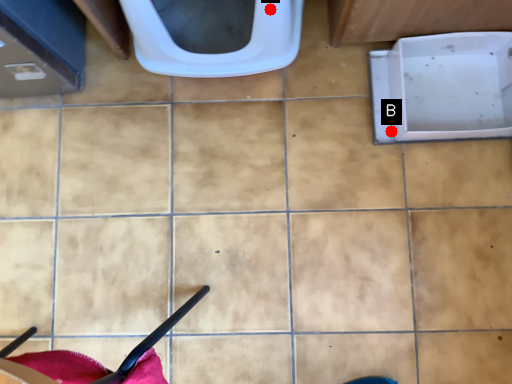
Question: Two points are circled on the image, labeled by A and B beside each circle. Which point appears closest to the camera in this image?

Choices:
 (A) A is closer
 (B) B is closer

Answer: (A)